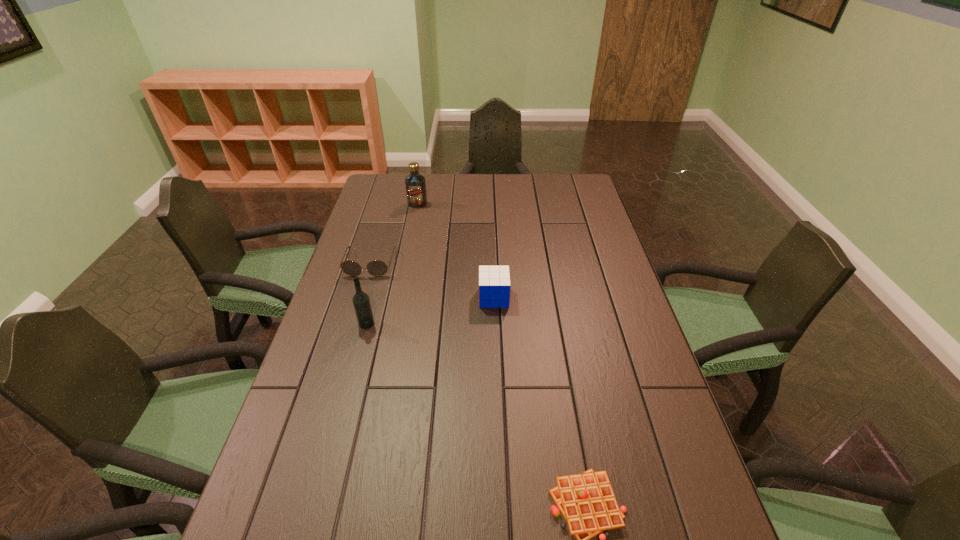
This screenshot has width=960, height=540. Identify the location of the farther vodka. (415, 183).

This screenshot has height=540, width=960. What are the coordinates of `the third object from right to left` in the screenshot? It's located at (415, 183).

Find the location of a particular element. the nearer vodka is located at coordinates (361, 301).

At what (x,y) coordinates should I click in order to perform the action: click on the left vodka. Please return your answer as a coordinate pair (x, y). The height and width of the screenshot is (540, 960). Looking at the image, I should click on (361, 301).

Locate an element on the screen. The height and width of the screenshot is (540, 960). the fourth object from left to right is located at coordinates (494, 281).

I want to click on the third farthest object, so click(x=494, y=281).

Where is `sunglasses`? The image size is (960, 540). sunglasses is located at coordinates (376, 268).

I want to click on the fourth tallest object, so click(x=376, y=268).

The height and width of the screenshot is (540, 960). I want to click on free region located on the front-facing side of the farthest object, so click(x=408, y=251).

Where is `free space located 0.270m on the right of the left vodka`? The width and height of the screenshot is (960, 540). free space located 0.270m on the right of the left vodka is located at coordinates (468, 323).